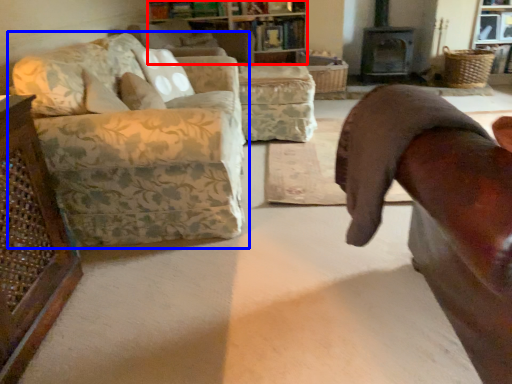
Question: Which point is closer to the camera, cabinetry (highlighted by a red box) or studio couch (highlighted by a blue box)?

Choices:
 (A) cabinetry
 (B) studio couch

Answer: (B)